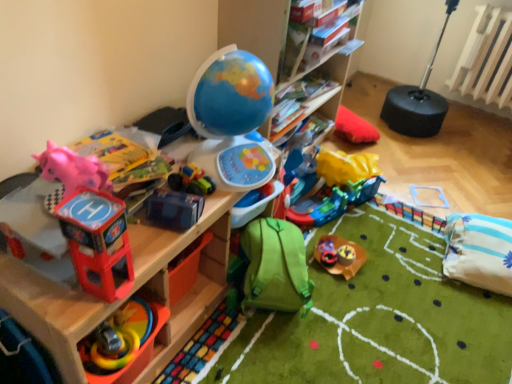
Question: Which is correct: rubberized plastic toy at lower left, the second toy from the left, is inside green fabric backpack at lower center, positioned as the fourth toy in right-to-left order, or outside of it?

Choices:
 (A) inside
 (B) outside

Answer: (B)

Question: In terms of height, does rubberized plastic toy at lower left, arranged as the 8th toy when viewed from the right, look taller or shorter compared to green fabric backpack at lower center, which is the sixth toy in left-to-right order?

Choices:
 (A) short
 (B) tall

Answer: (A)

Question: Based on their relative distances, which object is nearer to the rubberized plastic toy at center, the seventh toy viewed from the left?

Choices:
 (A) green fabric backpack at lower center, which is the sixth toy in left-to-right order
 (B) rubberized plastic toy at lower left, the second toy from the left
 (C) blue plastic toy at center, which ranks as the sixth toy in right-to-left order
 (D) white painted wood radiator at upper right
 (E) pink rubber duck at left, which appears as the 9th toy when viewed from the right

Answer: (A)

Question: Which object is positioned closest to the white painted wood radiator at upper right?

Choices:
 (A) blue plastic toy at center, the 4th toy viewed from the left
 (B) rubberized plastic toy at center, the third toy positioned from the right
 (C) red plastic helicopter at left, the 7th toy viewed from the right
 (D) blue matte globe at center, which appears as the fifth toy when viewed from the right
 (E) pink rubber duck at left, which appears as the 9th toy when viewed from the right

Answer: (B)